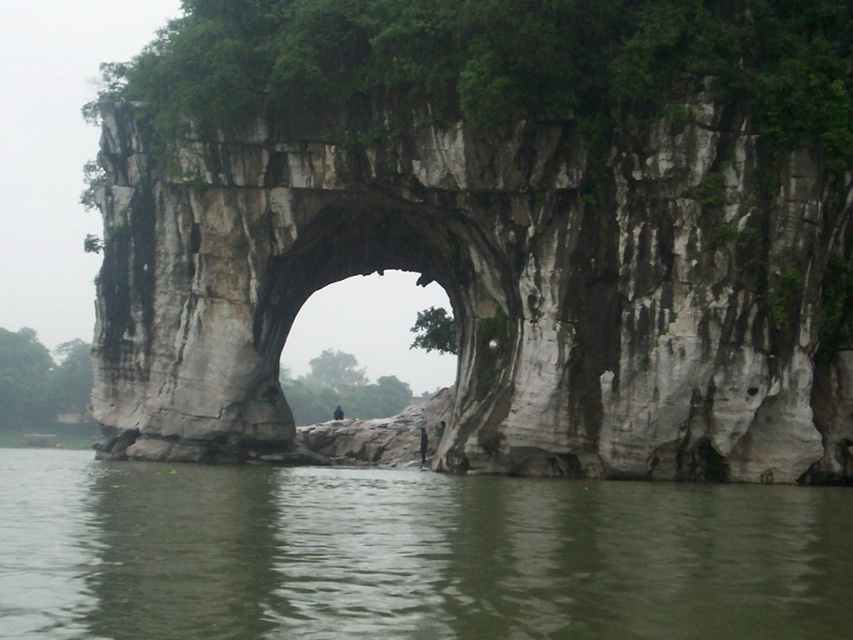
Based on the scene description, where is the gray weathered stone arch located? Please provide its coordinates as a point in the format of Point (494, 225).

The gray weathered stone arch is located at Point (494, 225).

You are standing at the base of the elephant rock formation and want to take a photo that includes both the archway and the water reflection. You notice two points marked on your map at coordinates point (x=119, y=592) and point (x=456, y=452). Which point should you choose to ensure you are closer to the archway while still capturing the water reflection in the foreground?

Point (x=119, y=592) is in front of point (x=456, y=452), so choosing point (x=119, y=592) will place you closer to the archway while still allowing the water reflection in the foreground to be captured in the photo.